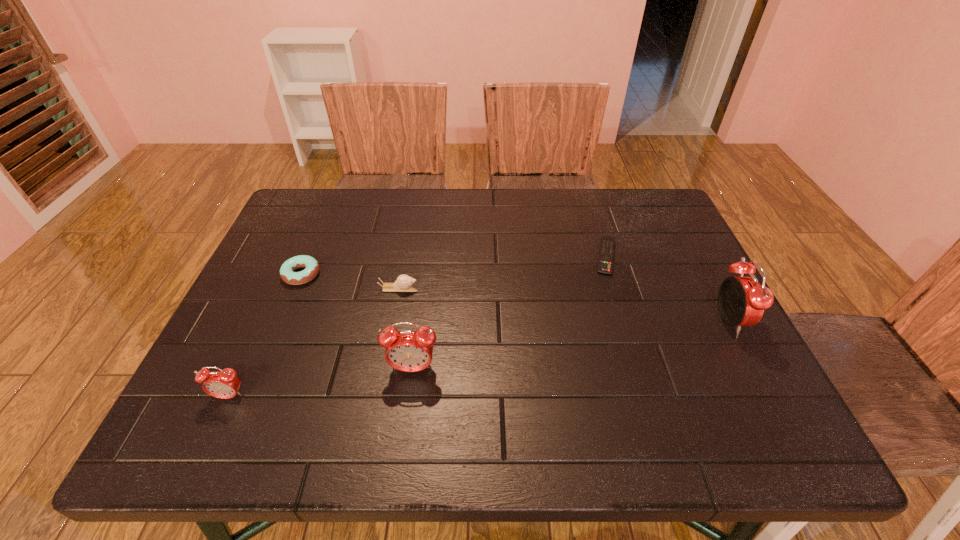
The image size is (960, 540). I want to click on vacant space positioned on the back of the shortest object, so click(588, 200).

The width and height of the screenshot is (960, 540). Identify the location of free space located 0.230m on the back of the doughnut. (328, 211).

Where is `free space located 0.070m on the shell of the third shortest object`? This screenshot has width=960, height=540. free space located 0.070m on the shell of the third shortest object is located at coordinates (446, 289).

Image resolution: width=960 pixels, height=540 pixels. In order to click on alarm clock that is at the left edge in this screenshot , I will do `click(224, 384)`.

Find the location of a particular element. The image size is (960, 540). doughnut positioned at the left edge is located at coordinates (287, 274).

Image resolution: width=960 pixels, height=540 pixels. I want to click on object present at the right edge, so click(x=742, y=300).

The image size is (960, 540). What are the coordinates of `object that is positioned at the near left corner` in the screenshot? It's located at [224, 384].

What are the coordinates of `vacant space at the far edge of the desktop` in the screenshot? It's located at (374, 211).

At what (x,y) coordinates should I click in order to perform the action: click on free space at the near edge of the desktop. Please return your answer as a coordinate pair (x, y). The width and height of the screenshot is (960, 540). Looking at the image, I should click on (592, 397).

In the image, there is a desktop. At what (x,y) coordinates should I click in order to perform the action: click on vacant space at the right edge. Please return your answer as a coordinate pair (x, y). The image size is (960, 540). Looking at the image, I should click on (685, 246).